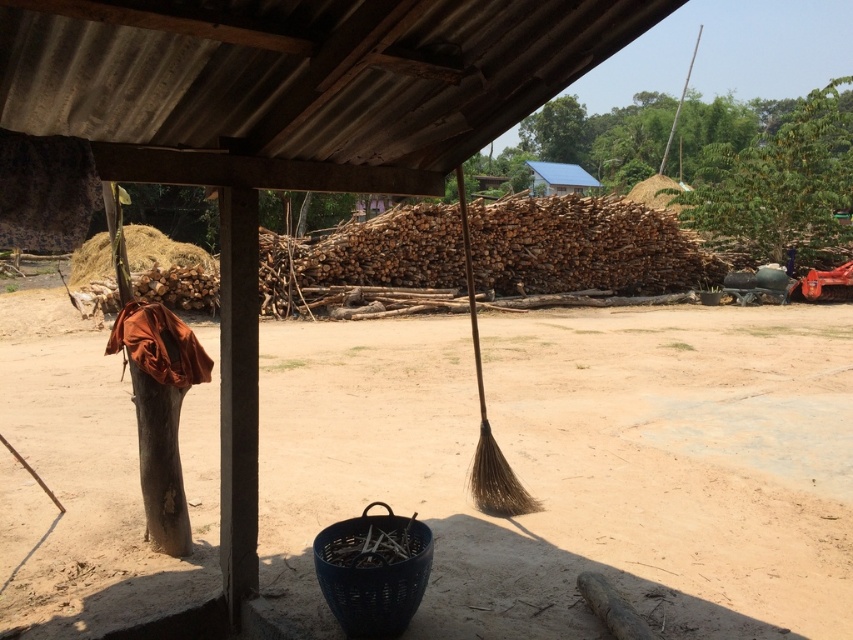
Who is shorter, brown dirt field at center or brown natural fiber broom at center?

brown dirt field at center

Is brown dirt field at center further to camera compared to brown natural fiber broom at center?

No, brown dirt field at center is in front of brown natural fiber broom at center.

Image resolution: width=853 pixels, height=640 pixels. What are the coordinates of `brown dirt field at center` in the screenshot? It's located at (577, 465).

Where is `brown dirt field at center`? This screenshot has width=853, height=640. brown dirt field at center is located at coordinates click(577, 465).